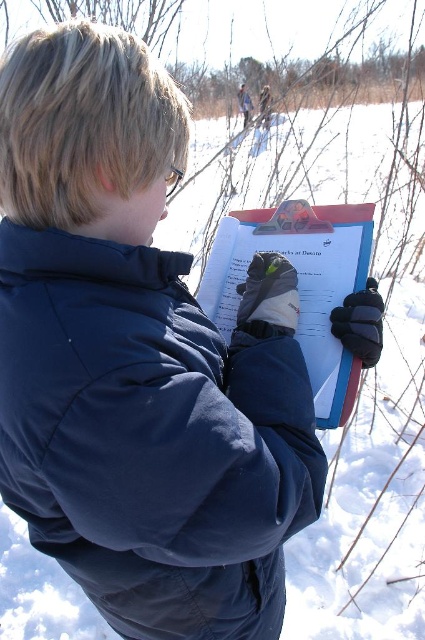
Is point (101, 570) in front of point (333, 212)?

That is True.

Between navy blue puffy jacket at center and matte plastic clipboard at center, which one is positioned lower?

Positioned lower is navy blue puffy jacket at center.

Locate an element on the screen. This screenshot has height=640, width=425. navy blue puffy jacket at center is located at coordinates (150, 436).

What are the coordinates of `navy blue puffy jacket at center` in the screenshot? It's located at (150, 436).